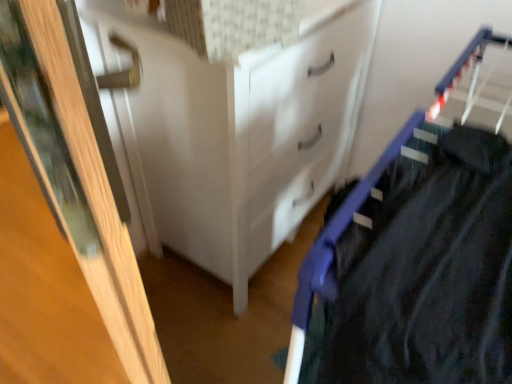
Question: Is wooden door at left facing away from white glossy chest of drawers at center?

Choices:
 (A) no
 (B) yes

Answer: (B)

Question: Is wooden door at left to the right of white glossy chest of drawers at center from the viewer's perspective?

Choices:
 (A) yes
 (B) no

Answer: (B)

Question: Is the position of wooden door at left less distant than that of white glossy chest of drawers at center?

Choices:
 (A) no
 (B) yes

Answer: (B)

Question: Is wooden door at left smaller than white glossy chest of drawers at center?

Choices:
 (A) no
 (B) yes

Answer: (B)

Question: From the image's perspective, is wooden door at left beneath white glossy chest of drawers at center?

Choices:
 (A) yes
 (B) no

Answer: (A)

Question: From a real-world perspective, does wooden door at left sit lower than white glossy chest of drawers at center?

Choices:
 (A) no
 (B) yes

Answer: (A)

Question: Is white glossy chest of drawers at center smaller than wooden door at left?

Choices:
 (A) yes
 (B) no

Answer: (B)

Question: Is wooden door at left surrounded by white glossy chest of drawers at center?

Choices:
 (A) yes
 (B) no

Answer: (B)

Question: Is white glossy chest of drawers at center further to camera compared to wooden door at left?

Choices:
 (A) no
 (B) yes

Answer: (B)

Question: From a real-world perspective, is white glossy chest of drawers at center located higher than wooden door at left?

Choices:
 (A) no
 (B) yes

Answer: (A)

Question: From the image's perspective, is white glossy chest of drawers at center located beneath wooden door at left?

Choices:
 (A) no
 (B) yes

Answer: (A)

Question: From the image's perspective, is white glossy chest of drawers at center on top of wooden door at left?

Choices:
 (A) yes
 (B) no

Answer: (A)

Question: Looking at their shapes, would you say wooden door at left is wider or thinner than white glossy chest of drawers at center?

Choices:
 (A) thin
 (B) wide

Answer: (A)